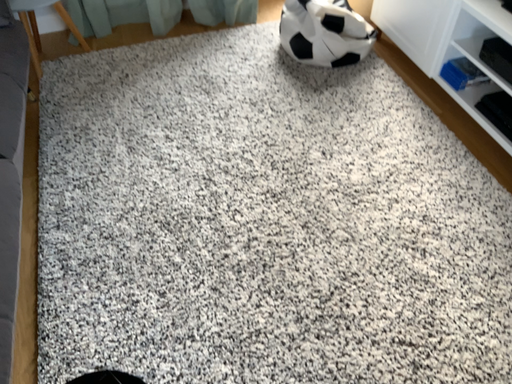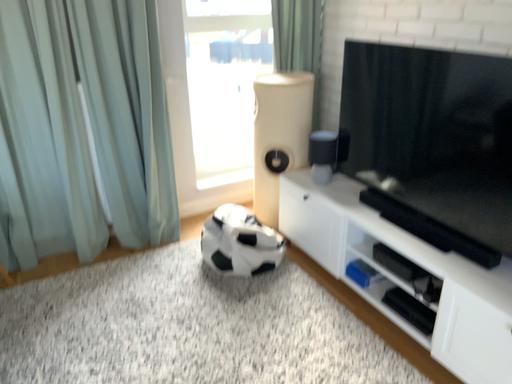
Question: How did the camera likely rotate when shooting the video?

Choices:
 (A) rotated right
 (B) rotated left

Answer: (A)